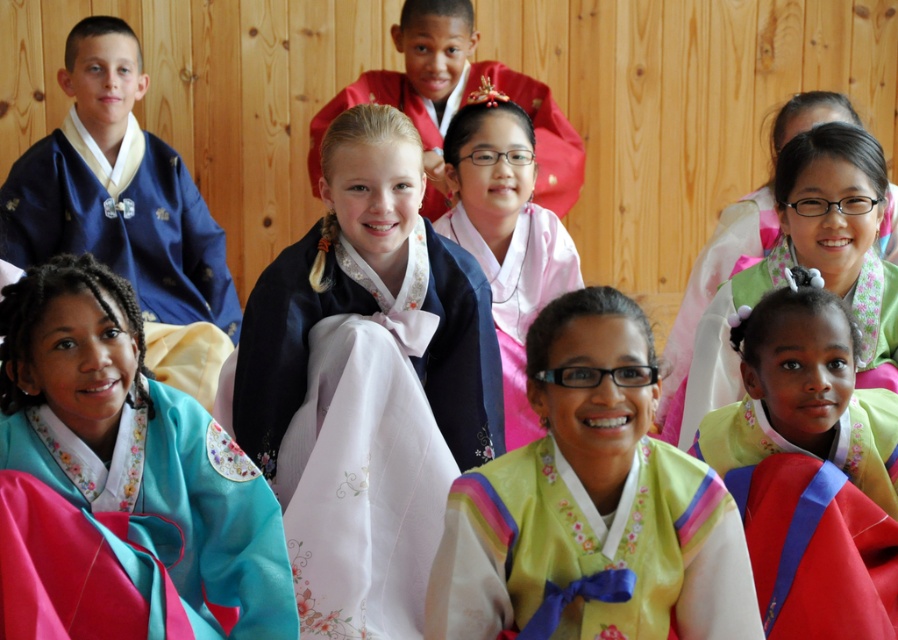
Who is positioned more to the right, matte yellow silk blouse at center or matte pink fabric at center?

matte yellow silk blouse at center is more to the right.

The height and width of the screenshot is (640, 898). Describe the element at coordinates (590, 504) in the screenshot. I see `matte yellow silk blouse at center` at that location.

Identify the location of matte yellow silk blouse at center. This screenshot has width=898, height=640. (590, 504).

In the scene shown: Does matte pink kimono at center appear on the right side of teal satin blouse at lower left?

Indeed, matte pink kimono at center is positioned on the right side of teal satin blouse at lower left.

Is matte pink kimono at center thinner than teal satin blouse at lower left?

Correct, matte pink kimono at center's width is less than teal satin blouse at lower left's.

The width and height of the screenshot is (898, 640). What are the coordinates of `matte pink kimono at center` in the screenshot? It's located at (814, 500).

Can you confirm if satin blue dress at center is shorter than pink satin blouse at center?

Incorrect, satin blue dress at center's height does not fall short of pink satin blouse at center's.

Which of these two, satin blue dress at center or pink satin blouse at center, stands taller?

satin blue dress at center

I want to click on satin blue dress at center, so click(366, 384).